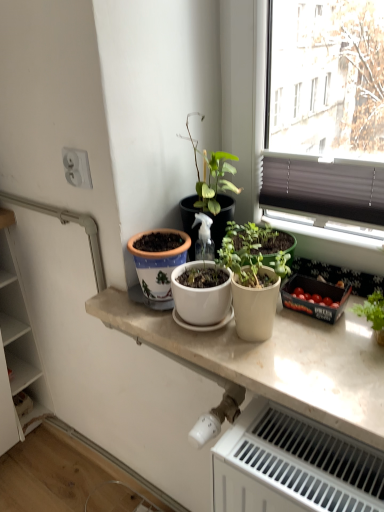
Question: Is point (258, 295) closer or farther from the camera than point (185, 244)?

Choices:
 (A) closer
 (B) farther

Answer: (A)

Question: Relative to white ceramic pot at center, is matte white pot at center in front or behind?

Choices:
 (A) front
 (B) behind

Answer: (A)

Question: Considering the real-world distances, which object is closest to the white plastic electrical outlet at upper left?

Choices:
 (A) white matte countertop at center
 (B) white plastic radiator at lower right
 (C) white ceramic pot at center
 (D) matte white pot at center
 (E) white wood cabinet at left

Answer: (C)

Question: Which is farther from the white plastic electrical outlet at upper left?

Choices:
 (A) matte white pot at center
 (B) white ceramic pot at center
 (C) white plastic radiator at lower right
 (D) white matte countertop at center
 (E) white wood cabinet at left

Answer: (E)